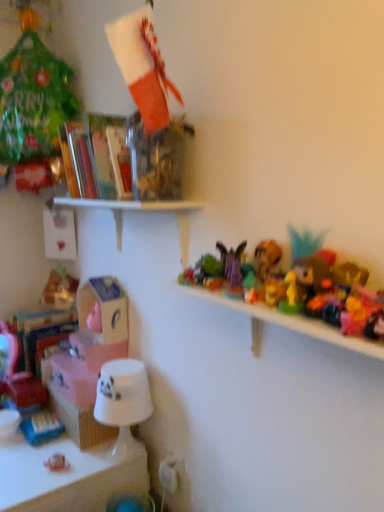
You are a GUI agent. You are given a task and a screenshot of the screen. Output one action in this format:
    pyautogui.click(x=<x>, y=<y>)
    Task: Click on the vacant space situated on the left part of white glossy lampshade at lower left
    This screenshot has height=512, width=384.
    Given the screenshot: What is the action you would take?
    pyautogui.click(x=63, y=462)